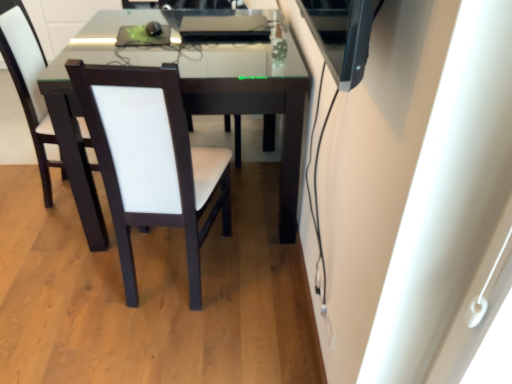
This screenshot has height=384, width=512. In order to click on blank area to the left of white leather chair at center, which ranks as the 2th chair in right-to-left order in this screenshot , I will do `click(61, 279)`.